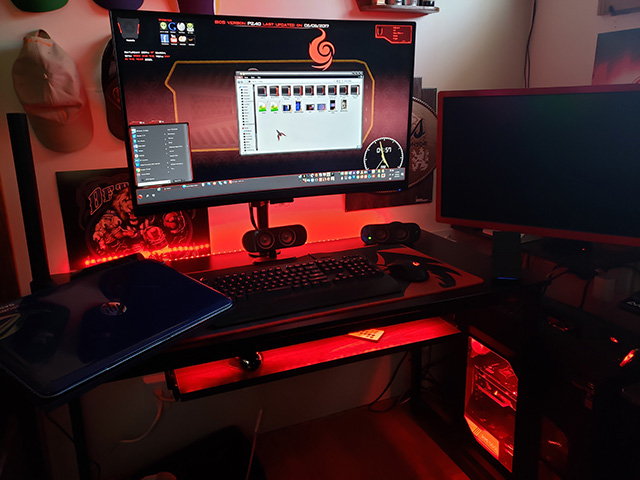
Where is `keyboard`? The image size is (640, 480). keyboard is located at coordinates (285, 281).